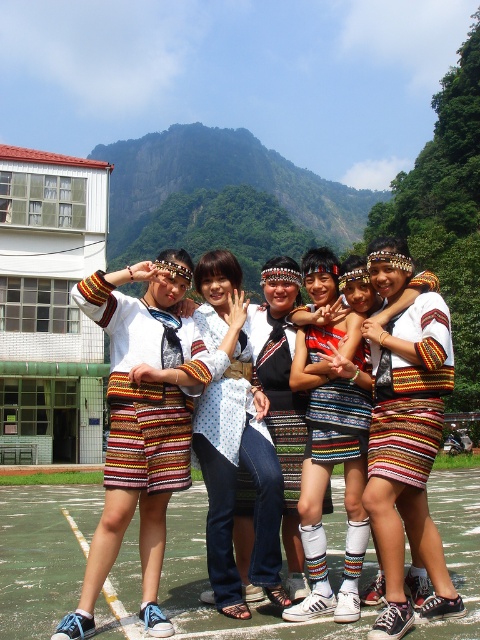
Based on the photo, is white dotted shirt at center positioned at the back of knitted multicolored skirt at center?

Yes, it is behind knitted multicolored skirt at center.

Which is in front, point (272, 472) or point (351, 577)?

Positioned in front is point (351, 577).

Is point (257, 513) closer to camera compared to point (323, 358)?

Yes, point (257, 513) is closer to viewer.

Image resolution: width=480 pixels, height=640 pixels. What are the coordinates of `white dotted shirt at center` in the screenshot? It's located at (232, 438).